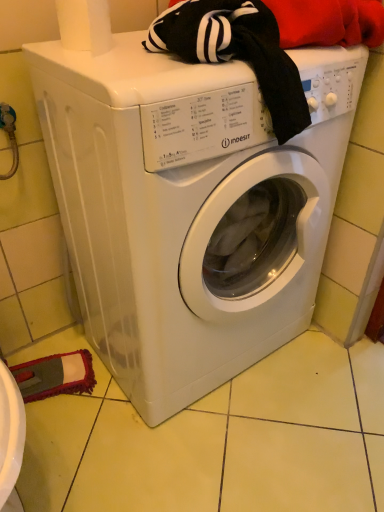
The height and width of the screenshot is (512, 384). Find the location of `vacant space that is to the left of white paper towel at upper left`. vacant space that is to the left of white paper towel at upper left is located at coordinates (46, 48).